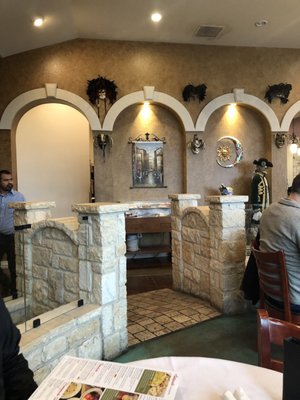
Locate an element on the screen. The image size is (300, 400). table is located at coordinates (206, 378).